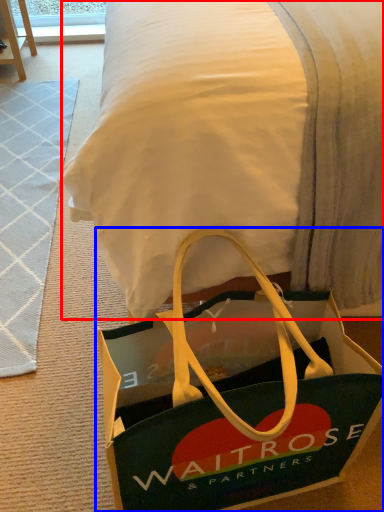
Question: Among these objects, which one is nearest to the camera, blanket (highlighted by a red box) or handbag (highlighted by a blue box)?

Choices:
 (A) blanket
 (B) handbag

Answer: (A)